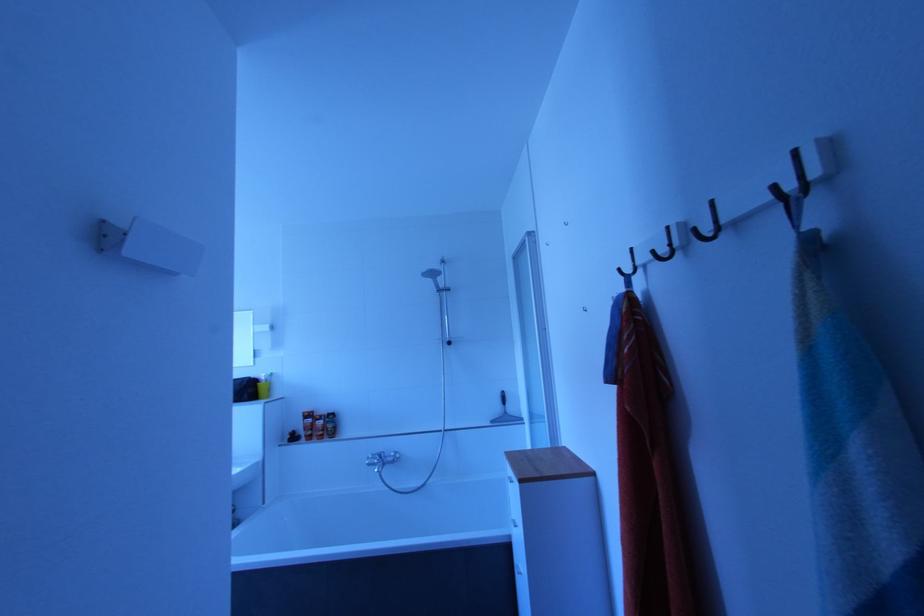
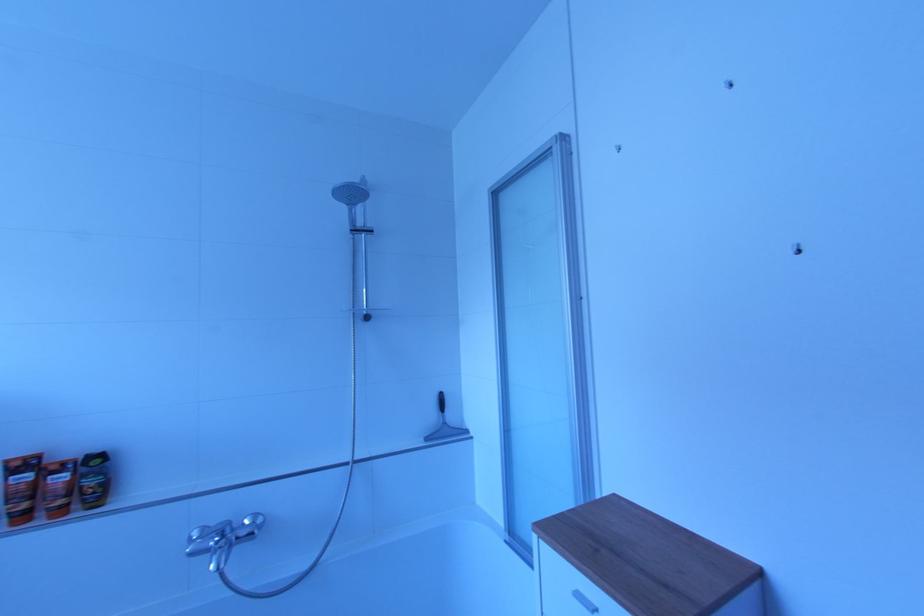
In a continuous first-person perspective shot, in which direction is the camera moving?

The cameraman moved toward left, forward.